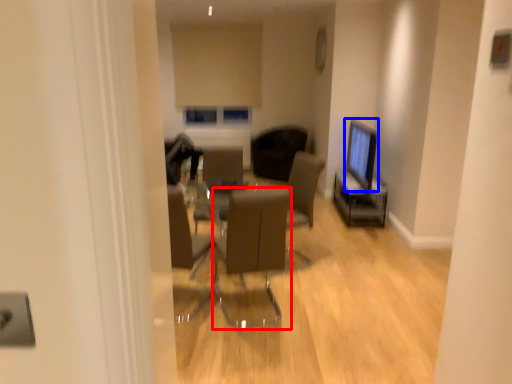
Question: Which object appears farthest to the camera in this image, chair (highlighted by a red box) or computer monitor (highlighted by a blue box)?

Choices:
 (A) chair
 (B) computer monitor

Answer: (B)